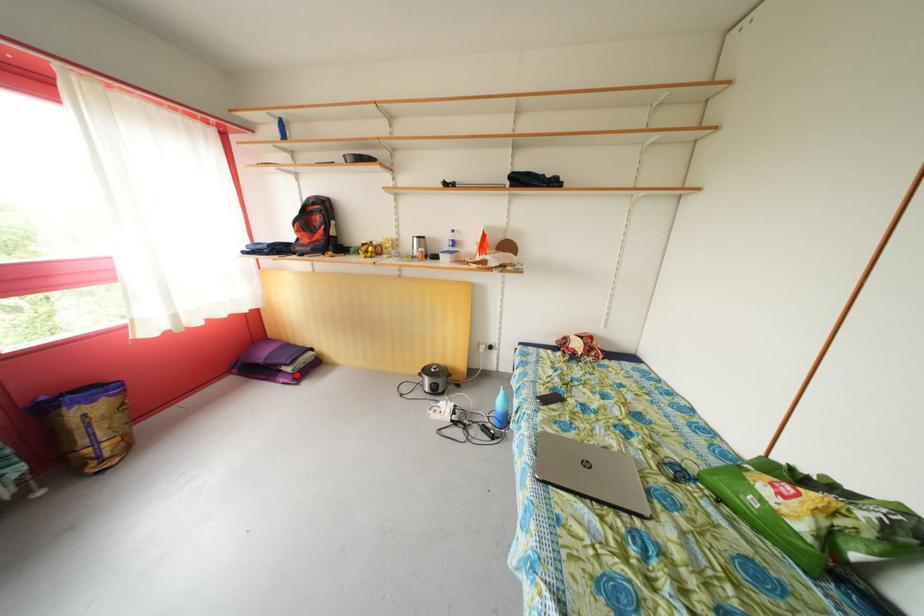
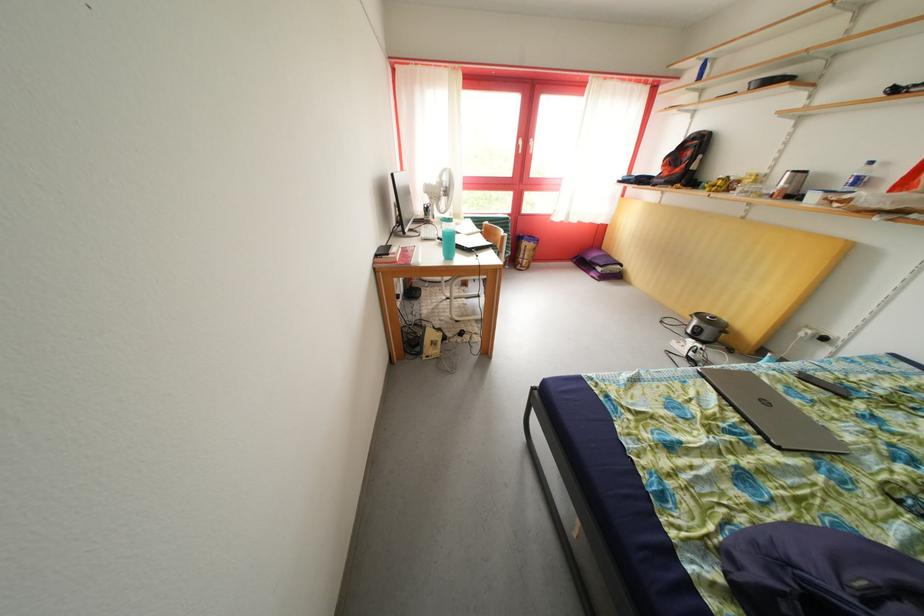
Locate, in the second image, the point that corresponds to the highlighted location in the first image.

(608, 275)